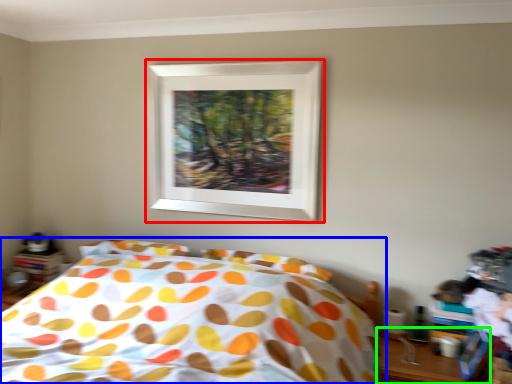
Question: Based on their relative distances, which object is farther from picture frame (highlighted by a red box)? Choose from bed (highlighted by a blue box) and table (highlighted by a green box).

Choices:
 (A) bed
 (B) table

Answer: (B)